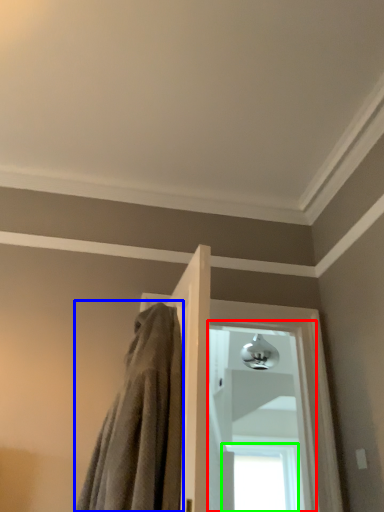
Question: Which is nearer to the window (highlighted by a red box)? bath towel (highlighted by a blue box) or window (highlighted by a green box).

Choices:
 (A) bath towel
 (B) window

Answer: (B)